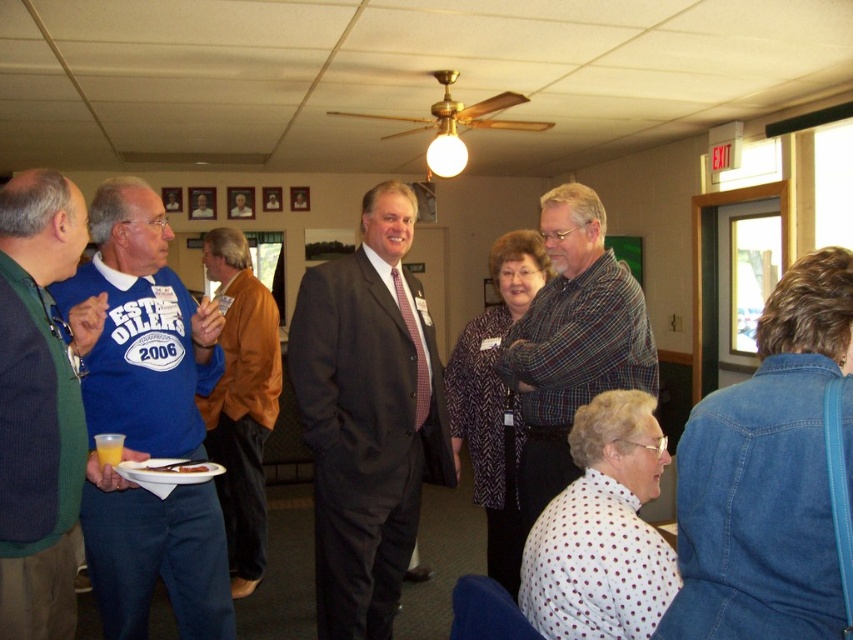
You are standing in the room and want to greet both the person wearing the blue cotton shirt at left and the person wearing the green wool sweater at left. Which person will you reach first if you walk straight towards them?

You will reach the blue cotton shirt at left first because it is closer to you than the green wool sweater at left.

You are standing at the center of the room and want to move to the doorway leading outside. There is a dark gray suit at center located at point (367, 417). Is the dark gray suit at center blocking your path to the doorway?

The dark gray suit at center is located at point (367, 417). Since the doorway is mentioned to be above a row of framed pictures on the wall, and the suit is at the center, it is likely blocking the path to the doorway.